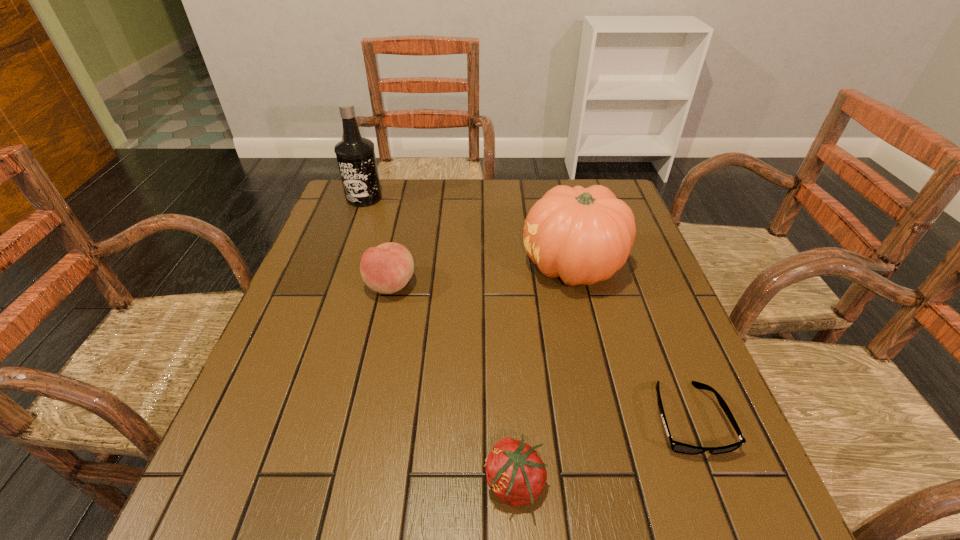
This screenshot has height=540, width=960. Find the location of `the leftmost object`. the leftmost object is located at coordinates (355, 155).

Locate an element on the screen. The height and width of the screenshot is (540, 960). the tallest object is located at coordinates (355, 155).

You are a GUI agent. You are given a task and a screenshot of the screen. Output one action in this format:
    pyautogui.click(x=<x>, y=<y>)
    Task: Click on the second tallest object
    The width and height of the screenshot is (960, 540).
    Given the screenshot: What is the action you would take?
    pyautogui.click(x=583, y=235)

What are the coordinates of `the third tallest object` in the screenshot? It's located at (387, 268).

You are a GUI agent. You are given a task and a screenshot of the screen. Output one action in this format:
    pyautogui.click(x=<x>, y=<y>)
    Task: Click on the peach
    
    Given the screenshot: What is the action you would take?
    pyautogui.click(x=387, y=268)

Locate an element on the screen. tomato is located at coordinates (515, 473).

What are the coordinates of `the shortest object` in the screenshot? It's located at (678, 447).

Identify the location of free space located 0.260m on the front label of the liquor. (341, 264).

Where is `free point located on the carved face of the second tallest object`? free point located on the carved face of the second tallest object is located at coordinates (396, 266).

At what (x,y) coordinates should I click in order to perform the action: click on vacant space located on the carved face of the second tallest object. Please return your answer as a coordinate pair (x, y). Looking at the image, I should click on (416, 266).